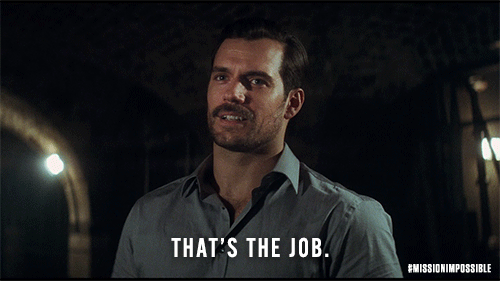
Image resolution: width=500 pixels, height=281 pixels. Find the location of `corner of arch shape`. corner of arch shape is located at coordinates (82, 189).